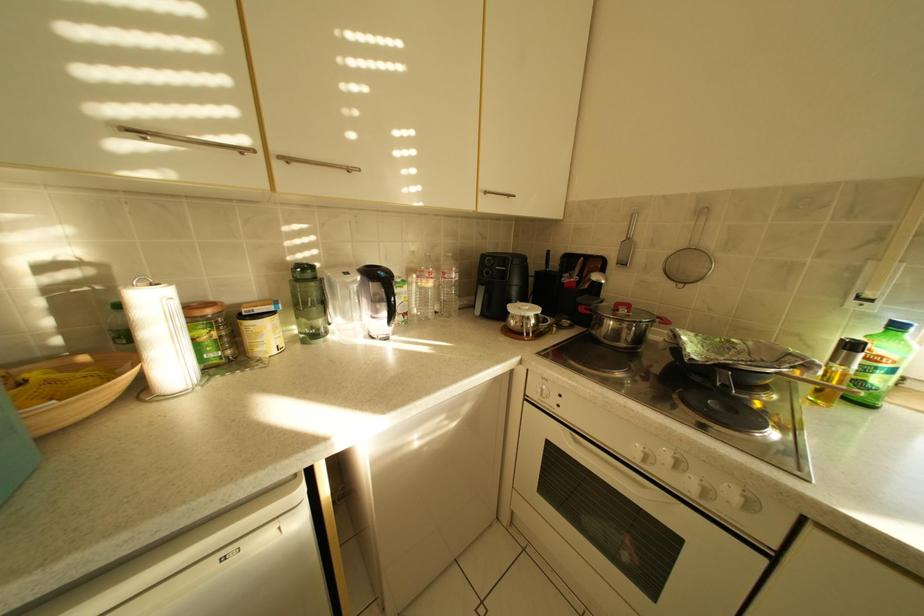
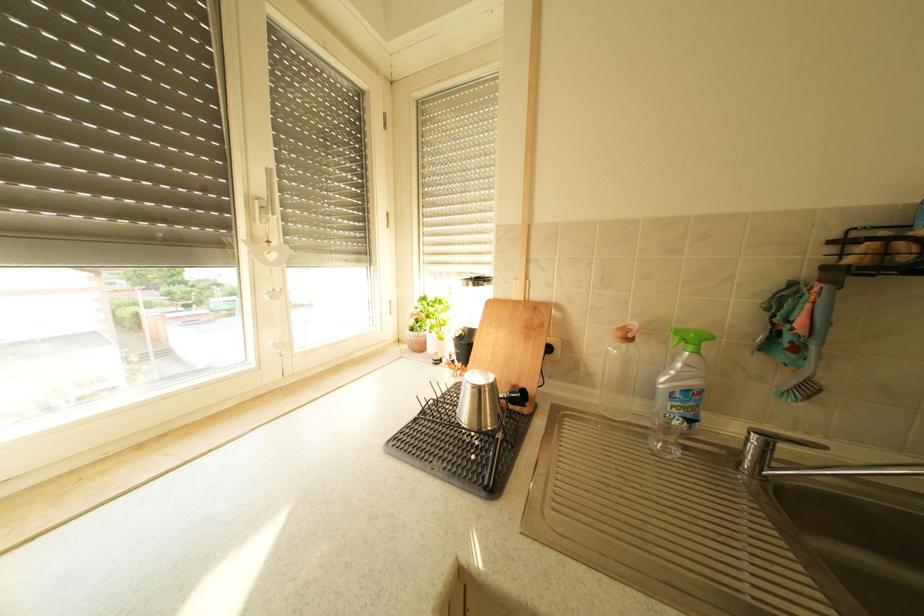
Consider the image. First-person continuous shooting, in which direction is the camera rotating?

The rotation direction of the camera is right-down.